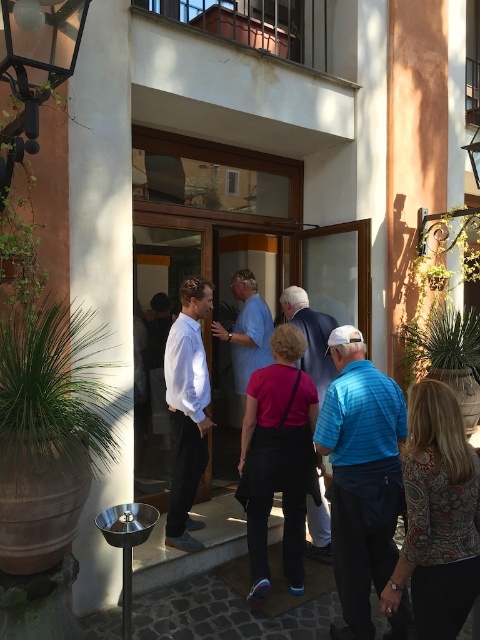
Question: Among these objects, which one is nearest to the camera?

Choices:
 (A) white smooth shirt at center
 (B) silver metallic pole at left
 (C) matte pink shirt at center

Answer: (B)

Question: Which object is farther from the camera taking this photo?

Choices:
 (A) printed fabric jacket at lower right
 (B) white smooth shirt at center
 (C) silver metallic pole at left
 (D) matte pink shirt at center

Answer: (B)

Question: Is blue striped polo shirt at center below printed fabric jacket at lower right?

Choices:
 (A) no
 (B) yes

Answer: (B)

Question: Is silver metallic pole at left closer to camera compared to white smooth shirt at center?

Choices:
 (A) yes
 (B) no

Answer: (A)

Question: Can you confirm if silver metallic pole at left is positioned below white smooth shirt at center?

Choices:
 (A) no
 (B) yes

Answer: (A)

Question: Among these objects, which one is nearest to the camera?

Choices:
 (A) silver metallic pole at left
 (B) matte pink shirt at center
 (C) printed fabric jacket at lower right

Answer: (C)